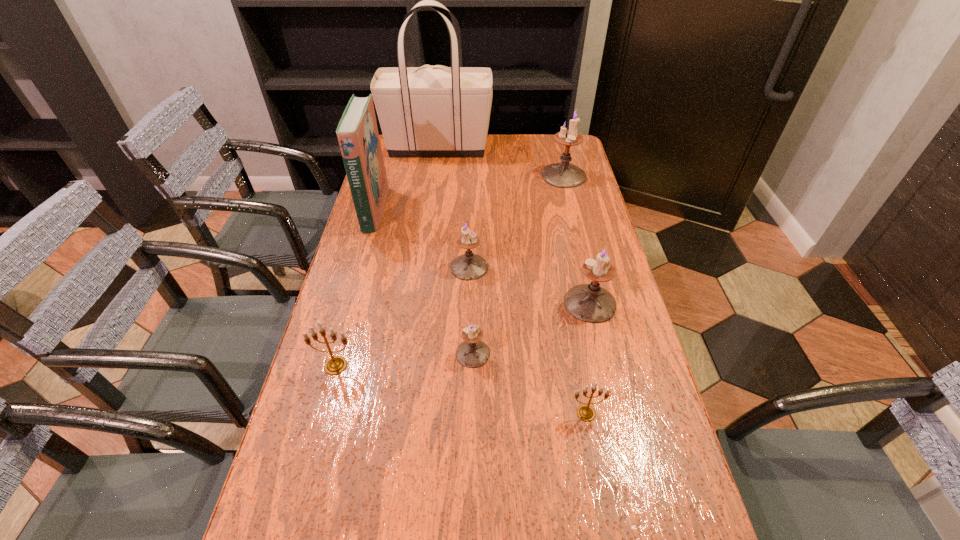
Identify the location of vacant region between the third farthest candelabrum and the nearest candelabrum. The height and width of the screenshot is (540, 960). (588, 358).

Image resolution: width=960 pixels, height=540 pixels. Identify the location of object that is the fifth closest to the bigger gold candelabrum. (590, 303).

The height and width of the screenshot is (540, 960). Identify the location of the fifth closest object to the bigger gold candelabrum. (590, 303).

Select which candelabrum is the closest to the second smallest purple candle holder. Please provide its 2D coordinates. Your answer should be formatted as a tuple, i.e. [(x, y)], where the tuple contains the x and y coordinates of a point satisfying the conditions above.

[(590, 303)]

Point out which candelabrum is positioned as the second nearest to the left gold candelabrum. Please provide its 2D coordinates. Your answer should be formatted as a tuple, i.e. [(x, y)], where the tuple contains the x and y coordinates of a point satisfying the conditions above.

[(469, 266)]

The image size is (960, 540). Identify the location of purple candle holder object that ranks as the third closest to the farthest purple candle holder. (472, 353).

Identify the location of purple candle holder that stands as the second closest to the left gold candelabrum. This screenshot has height=540, width=960. (469, 266).

Identify the location of free space that satisfies the following two spatial constraints: 1. on the cover of the nearest candelabrum; 2. on the left side of the hardback book. (318, 413).

Identify the location of vacant area that satisfies the following two spatial constraints: 1. with handles facing forward on the nearest purple candle holder; 2. on the left side of the tallest object. This screenshot has width=960, height=540. (410, 354).

Identify the location of free location that satisfies the following two spatial constraints: 1. on the cover of the hardback book; 2. on the left side of the nearest purple candle holder. (334, 354).